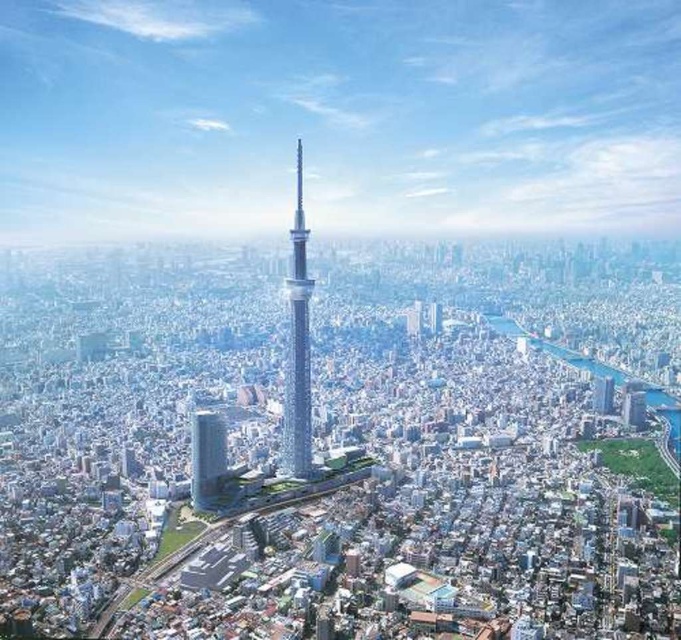
You are a drone operator trying to navigate between two landmarks in the city. You see the sleek glass tower at center and the smooth glass skyscraper at center. Which one is positioned to the right when viewed from above?

The sleek glass tower at center is positioned to the right of the smooth glass skyscraper at center when viewed from above.

You are standing at the observation deck of the skyscraper in the center of the city. You see two points in the city below you, labeled as point 1 at coordinates point (289, 316) and point 2 at coordinates point (221, 456). Which point is closer to you?

Point (289, 316) is closer to the viewer than point (221, 456). Therefore, point 1 is closer to you.

You are a drone operator who needs to fly a drone from the sleek glass tower at center to the smooth glass skyscraper at center. According to the image, which direction should you fly the drone to reach the destination?

The sleek glass tower at center is located above the smooth glass skyscraper at center, so you should fly the drone downward to reach the smooth glass skyscraper at center.